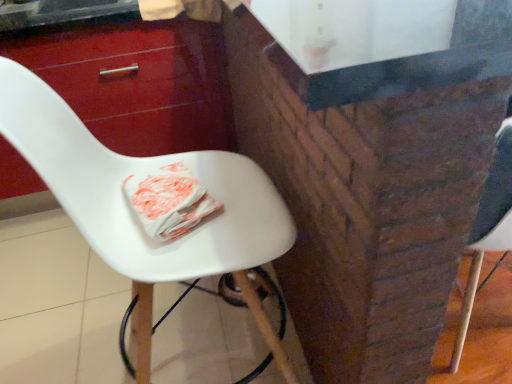
Question: In terms of height, does white plastic chair at center look taller or shorter compared to glossy wood drawer at upper left?

Choices:
 (A) tall
 (B) short

Answer: (A)

Question: Would you say white plastic chair at center is inside or outside glossy wood drawer at upper left?

Choices:
 (A) inside
 (B) outside

Answer: (B)

Question: In the image, is white plastic chair at center positioned in front of or behind glossy wood drawer at upper left?

Choices:
 (A) behind
 (B) front

Answer: (B)

Question: Visually, is glossy wood drawer at upper left positioned to the left or to the right of white plastic chair at center?

Choices:
 (A) right
 (B) left

Answer: (B)

Question: Is point (93, 79) closer or farther from the camera than point (259, 218)?

Choices:
 (A) farther
 (B) closer

Answer: (A)

Question: From a real-world perspective, relative to white plastic chair at center, is glossy wood drawer at upper left vertically above or below?

Choices:
 (A) below
 (B) above

Answer: (A)

Question: Looking at the image, does glossy wood drawer at upper left seem bigger or smaller compared to white plastic chair at center?

Choices:
 (A) big
 (B) small

Answer: (A)